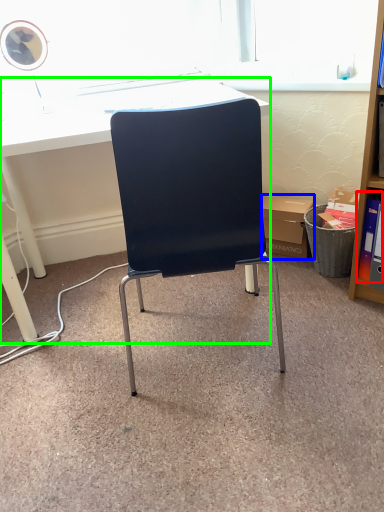
Question: Estimate the real-world distances between objects in this image. Which object is closer to book (highlighted by a red box), box (highlighted by a blue box) or desk (highlighted by a green box)?

Choices:
 (A) box
 (B) desk

Answer: (A)